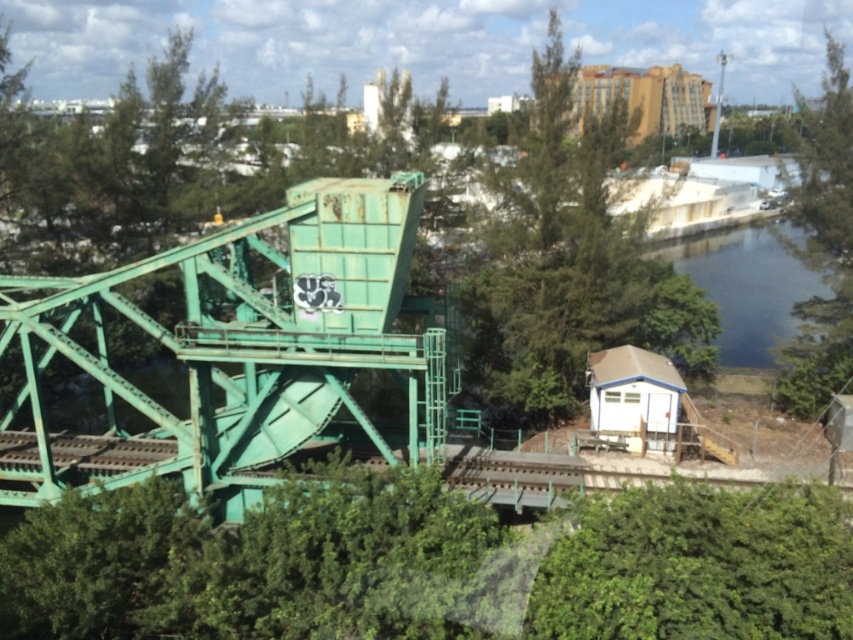
You are a construction worker standing at the base of the crane. You need to cross to the dark blue water at center right to inspect a buoy. The rusty green metal bridge at center is the only path available. Can you safely walk across the bridge to reach the water?

The rusty green metal bridge at center is 74.57 feet away from the dark blue water at center right. Since the bridge is the only path and there is no mention of structural issues, you can safely walk across the bridge to reach the dark blue water at center right.

Based on the photo, you are standing at the base of the green leafy tree at right. You want to take a photo of the large, green, metal structure that is part of a crane or lifting mechanism. The camera you have can focus on objects up to 50 meters away. Can you capture the entire structure in your photo without moving closer?

The green leafy tree at right and camera are 43.80 meters apart from each other. Since the camera can focus up to 50 meters, the distance is within range. Therefore, you can capture the entire structure without moving closer.

You are a delivery truck driver who needs to cross the rusty green metal bridge at center to reach the green leafy tree at right. Can you safely cross the bridge if your truck requires a minimum clearance of 15 feet between the bridge and the green leafy tree?

The rusty green metal bridge at center and green leafy tree at right are 73.08 feet apart, so yes, the truck can safely cross the bridge as the distance between them is more than sufficient for the required 15 feet clearance.